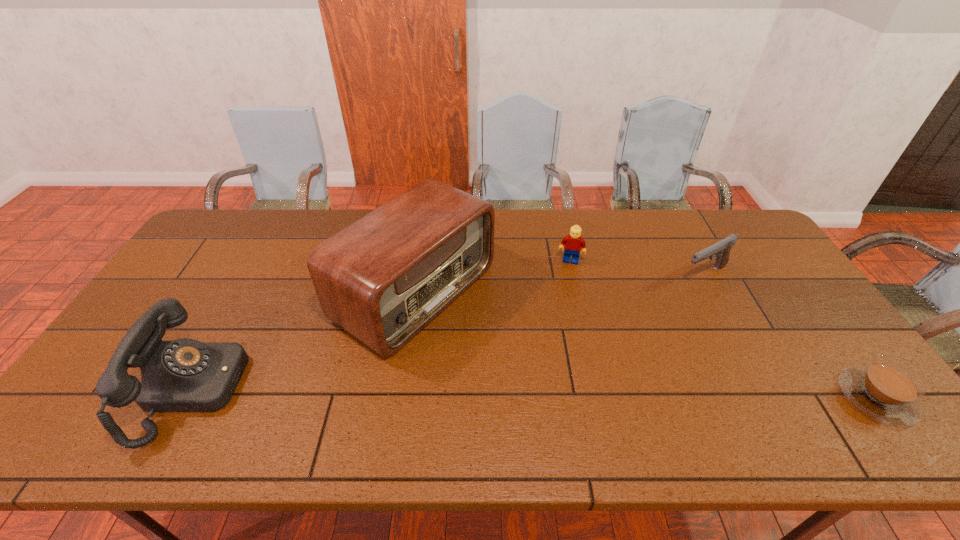
Locate an element on the screen. free spot located on the front panel of the radio receiver is located at coordinates (555, 377).

You are a GUI agent. You are given a task and a screenshot of the screen. Output one action in this format:
    pyautogui.click(x=<x>, y=<y>)
    Task: Click on the blank space located on the front panel of the radio receiver
    The image size is (960, 540).
    Given the screenshot: What is the action you would take?
    pyautogui.click(x=509, y=350)

Find the location of a particular element. This screenshot has height=540, width=960. free location located on the front panel of the radio receiver is located at coordinates (591, 399).

The width and height of the screenshot is (960, 540). What are the coordinates of `blank area located on the front-facing side of the Lego` in the screenshot? It's located at (560, 309).

The width and height of the screenshot is (960, 540). Find the location of `vacant space located on the front-facing side of the Lego`. vacant space located on the front-facing side of the Lego is located at coordinates (562, 302).

Find the location of a particular element. The width and height of the screenshot is (960, 540). vacant region located on the front-facing side of the Lego is located at coordinates (550, 364).

Locate an element on the screen. This screenshot has height=540, width=960. free location located at the barrel of the pistol is located at coordinates (635, 308).

Image resolution: width=960 pixels, height=540 pixels. Identify the location of vacant space located 0.170m at the barrel of the pistol. (645, 303).

Identify the location of vacant space situated 0.320m at the barrel of the pistol. This screenshot has width=960, height=540. (607, 324).

Locate an element on the screen. object located at the far edge is located at coordinates (384, 278).